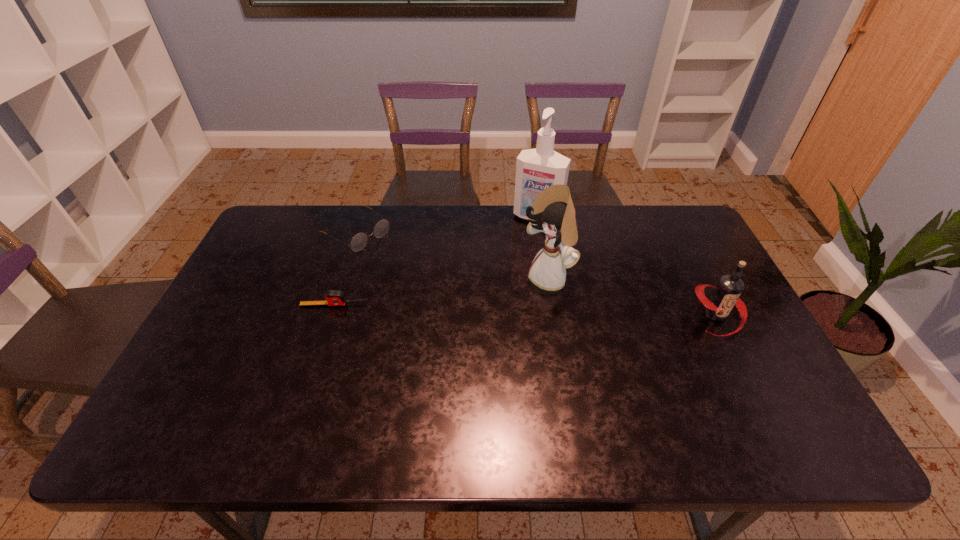
Find the location of a particular element. Image resolution: width=960 pixels, height=540 pixels. tape measure is located at coordinates (334, 297).

Identify the location of the third tallest object. (726, 294).

Identify the location of root beer. The width and height of the screenshot is (960, 540). (726, 294).

Find the location of a particular element. The width and height of the screenshot is (960, 540). the tallest object is located at coordinates (537, 169).

Where is `the fourth shortest object`? The image size is (960, 540). the fourth shortest object is located at coordinates (553, 211).

Where is `the second shortest object`? The image size is (960, 540). the second shortest object is located at coordinates (359, 241).

The width and height of the screenshot is (960, 540). What are the coordinates of `free space located on the left of the shortest object` in the screenshot? It's located at (229, 304).

This screenshot has height=540, width=960. In order to click on free space located 0.090m on the label of the rightmost object in this screenshot , I will do `click(743, 368)`.

Locate an element on the screen. vacant space located on the front label of the cleansing agent is located at coordinates (490, 300).

This screenshot has width=960, height=540. I want to click on vacant space located 0.080m on the front label of the cleansing agent, so click(x=522, y=240).